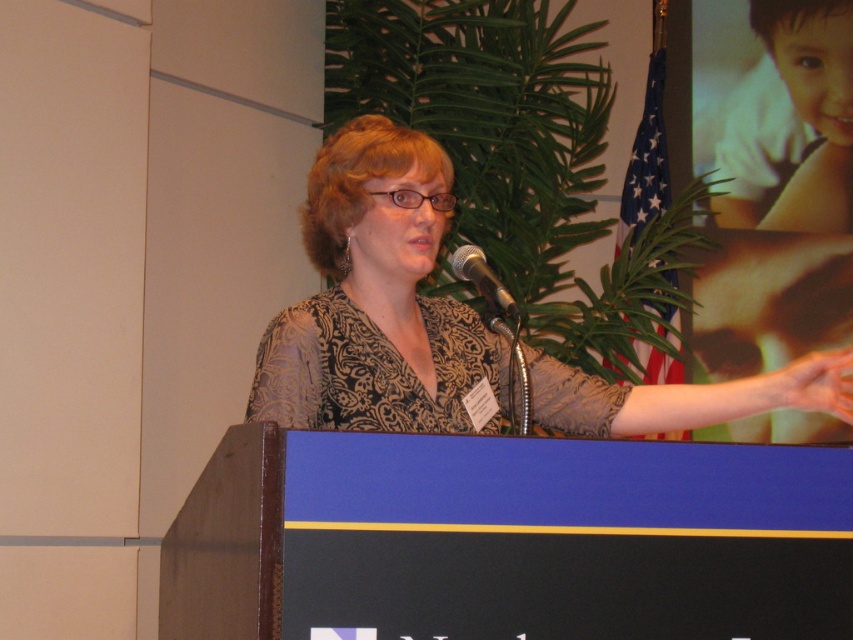
You are a photographer positioned to capture the speaker at the event. You need to ensure that the patterned fabric woman at center and the metallic silver microphone at center are both clearly visible in the frame. Considering their sizes, which object should you focus on first to ensure proper focus?

The patterned fabric woman at center is taller than the metallic silver microphone at center. Therefore, you should focus on the patterned fabric woman at center first to ensure proper focus since it is larger and requires more attention for clarity.

Based on the photo, you are standing at the back of the room and want to approach the patterned fabric woman at center. If you move forward in a straight line, will you first reach the podium or the woman?

The patterned fabric woman at center is positioned at point (376, 300), which is closer to the viewer than the podium. Therefore, moving forward in a straight line, you will first reach the patterned fabric woman at center before the podium.

You are taking a photo of the woman at the podium. There are two points marked on the podium, one at coordinates point [494,397] and another at point [506,296]. Which point should you focus on to ensure the woman is in sharp focus?

You should focus on point [494,397] because it is closer to the camera than point [506,296], ensuring the woman standing at the podium is in sharp focus.